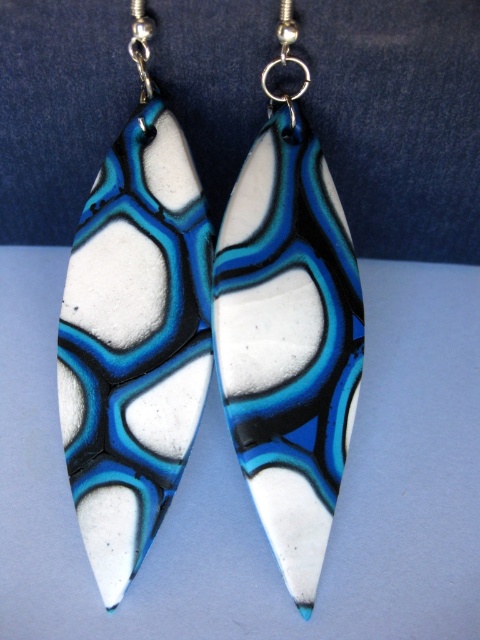
You are an earring designer examining two matte polymer clay earrings displayed on a table. You need to determine their sizes for packaging. Which of the two, the matte polymer clay earring at left or the matte polymer clay earring at center, is taller?

The matte polymer clay earring at center is taller than the matte polymer clay earring at left.

You are a jewelry designer who wants to place a new earring between the matte polymer clay earring at left and the matte polymer clay earring at center. The new earring is 5 centimeters wide. Is there enough space between them to fit the new earring?

The distance between the matte polymer clay earring at left and the matte polymer clay earring at center is 13.68 centimeters. Since the new earring is only 5 centimeters wide, there is sufficient space to place it between them.

Where is the matte polymer clay earring at left located in the image?

The matte polymer clay earring at left is located at point (134, 333).